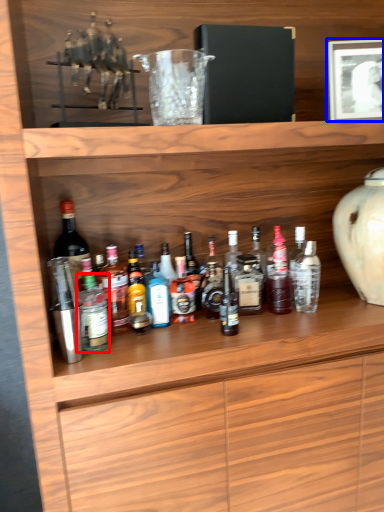
Question: Which object appears farthest to the camera in this image, bottle (highlighted by a red box) or picture frame (highlighted by a blue box)?

Choices:
 (A) bottle
 (B) picture frame

Answer: (B)